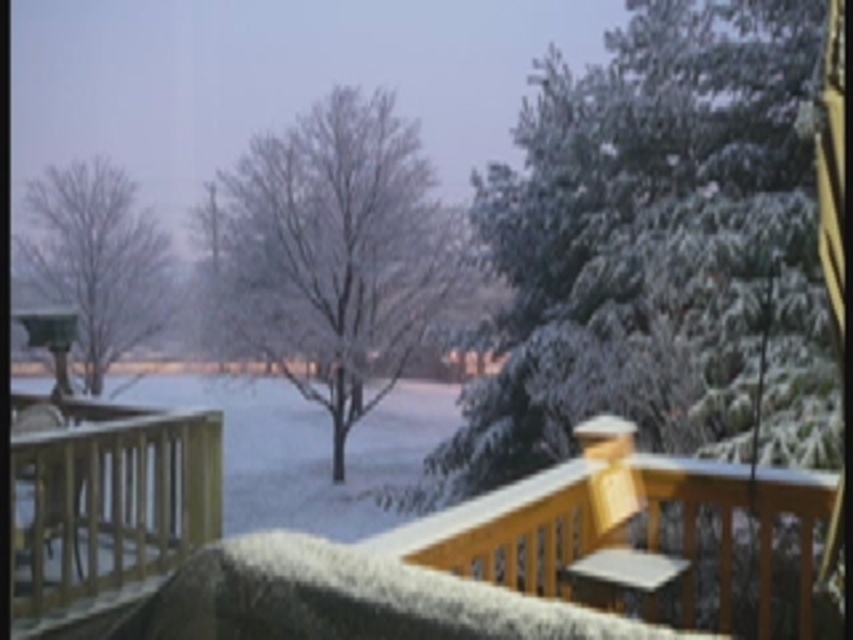
Who is positioned more to the left, snow-covered evergreen at upper right or wooden porch at center?

wooden porch at center is more to the left.

Does snow-covered evergreen at upper right have a lesser width compared to wooden porch at center?

Correct, snow-covered evergreen at upper right's width is less than wooden porch at center's.

Between point (635, 93) and point (566, 477), which one is positioned in front?

Positioned in front is point (566, 477).

Find the location of a particular element. This screenshot has height=640, width=853. snow-covered evergreen at upper right is located at coordinates (654, 253).

Is wooden porch at center to the left of snow-covered tree at center from the viewer's perspective?

No, wooden porch at center is not to the left of snow-covered tree at center.

What do you see at coordinates (384, 582) in the screenshot?
I see `wooden porch at center` at bounding box center [384, 582].

Is point (582, 488) positioned after point (396, 253)?

No, (582, 488) is in front of (396, 253).

I want to click on wooden porch at center, so click(x=384, y=582).

Who is more forward, (x=569, y=548) or (x=146, y=268)?

Point (x=569, y=548) is more forward.

Is wooden porch at center taller than bare wood tree at left?

Incorrect, wooden porch at center's height is not larger of bare wood tree at left's.

Find the location of a particular element. wooden porch at center is located at coordinates (384, 582).